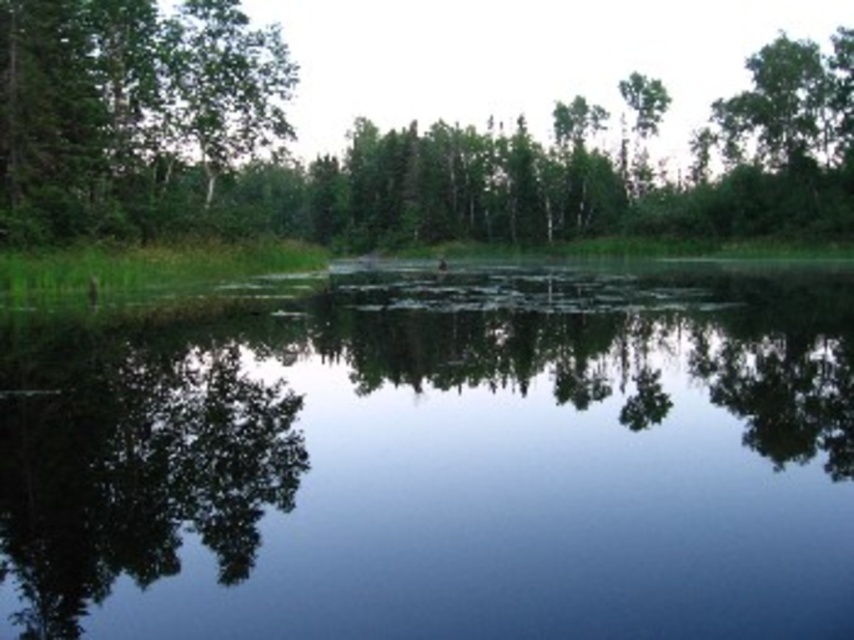
You are a photographer planning to capture a reflection of the green matte tree at upper left in the transparent water at center. Given that the distance between them is 26.27 meters, can you estimate whether the reflection will be clear enough to photograph?

The reflection of the green matte tree at upper left in the transparent water at center may not be clear because the water surface has ripples and minor disturbances, which can distort reflections. Even though the distance is 26.27 meters, the water disturbances might make the reflection too blurry for a clear photograph.

You are standing on the bank of the lake and see the transparent water at center and the green leafy tree at upper center. Which object is closer to the water surface?

The transparent water at center is located below the green leafy tree at upper center, so the transparent water at center is closer to the water surface.